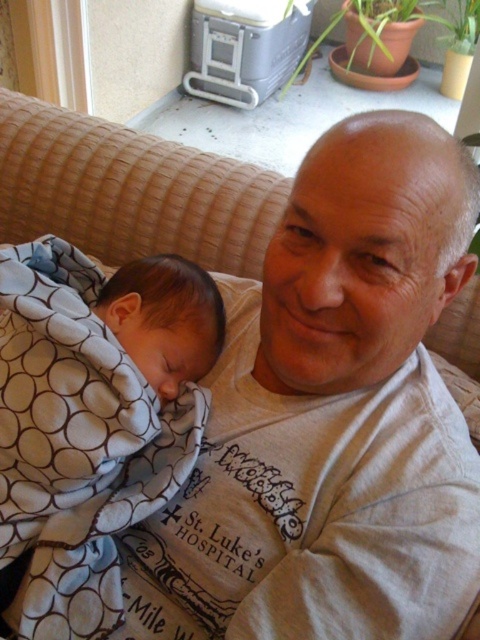
You are a photographer setting up for a family photo. You notice the white dotted fabric at left and the soft blue blanket at lower left in the scene. Which object is closer to the camera?

The white dotted fabric at left is in front of the soft blue blanket at lower left, so it is closer to the camera.

From the picture: You are a photographer setting up for a family photo. You have to place a white dotted fabric at left and a soft blue blanket at lower left. Given their widths, which one should you place closer to the center to ensure both fit within the frame?

The white dotted fabric at left is wider than the soft blue blanket at lower left. To ensure both fit within the frame, place the wider white dotted fabric at left closer to the center and the narrower soft blue blanket at lower left further away.